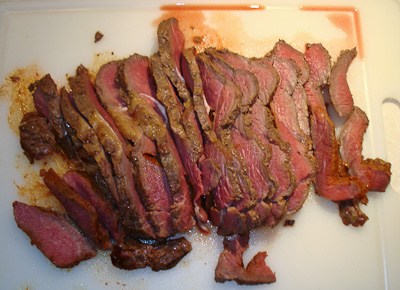
I want to click on cutting board, so click(x=388, y=80).